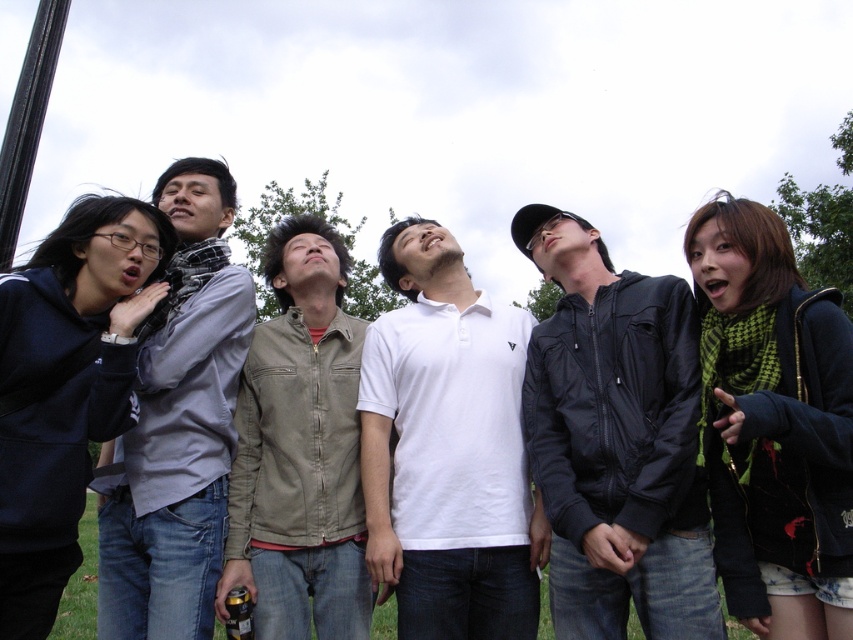
Is point (718, 353) positioned in front of point (231, 195)?

Yes, it is.

Is point (741, 525) closer to viewer compared to point (173, 540)?

Yes, point (741, 525) is in front of point (173, 540).

Where is `green checkered scarf at upper right`? Image resolution: width=853 pixels, height=640 pixels. green checkered scarf at upper right is located at coordinates (773, 422).

Can you confirm if black leather jacket at center is bigger than white cotton polo shirt at center?

Incorrect, black leather jacket at center is not larger than white cotton polo shirt at center.

Find the location of `black leather jacket at center`. black leather jacket at center is located at coordinates (614, 440).

Which is below, matte gray scarf at left or black metallic pole at upper left?

matte gray scarf at left is lower down.

How distant is matte gray scarf at left from black metallic pole at upper left?

matte gray scarf at left and black metallic pole at upper left are 1.72 meters apart from each other.

Image resolution: width=853 pixels, height=640 pixels. What do you see at coordinates (178, 424) in the screenshot?
I see `matte gray scarf at left` at bounding box center [178, 424].

This screenshot has height=640, width=853. Find the location of `matte gray scarf at left`. matte gray scarf at left is located at coordinates (178, 424).